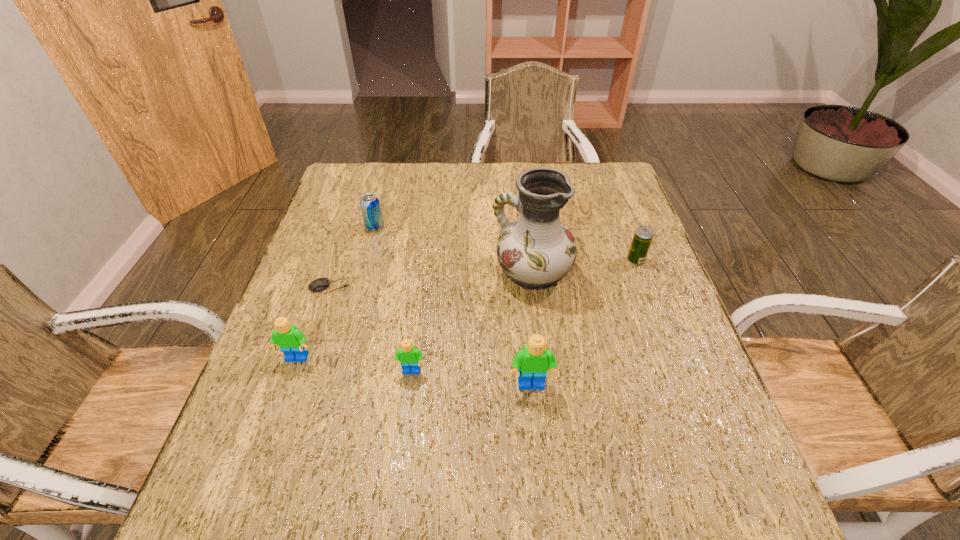
I want to click on the rightmost object, so (x=643, y=235).

Find the location of `mouse`. mouse is located at coordinates [321, 284].

At what (x,y) coordinates should I click in order to perform the action: click on free space located 0.130m on the face of the second shortest Lego. Please return your answer as a coordinate pair (x, y). Image resolution: width=960 pixels, height=540 pixels. Looking at the image, I should click on (274, 424).

The height and width of the screenshot is (540, 960). What are the coordinates of `vacant space located on the face of the second Lego from right to left` in the screenshot? It's located at (402, 438).

You are a GUI agent. You are given a task and a screenshot of the screen. Output one action in this format:
    pyautogui.click(x=<x>, y=<y>)
    Task: Click on the blank space located 0.130m on the face of the tallest Lego
    This screenshot has width=960, height=540.
    Given the screenshot: What is the action you would take?
    pyautogui.click(x=539, y=461)

Locate an element on the screen. The width and height of the screenshot is (960, 540). free point located on the front of the farthest object is located at coordinates (367, 256).

I want to click on vacant region located 0.090m on the left of the vase, so click(x=457, y=273).

This screenshot has width=960, height=540. Find the location of `free space located on the front of the rightmost object`. free space located on the front of the rightmost object is located at coordinates (678, 376).

Find the location of a particular element. This screenshot has height=540, width=960. free space located 0.200m on the right of the shortest object is located at coordinates (430, 286).

Locate an element on the screen. The width and height of the screenshot is (960, 540). Lego situated at the left edge is located at coordinates (292, 341).